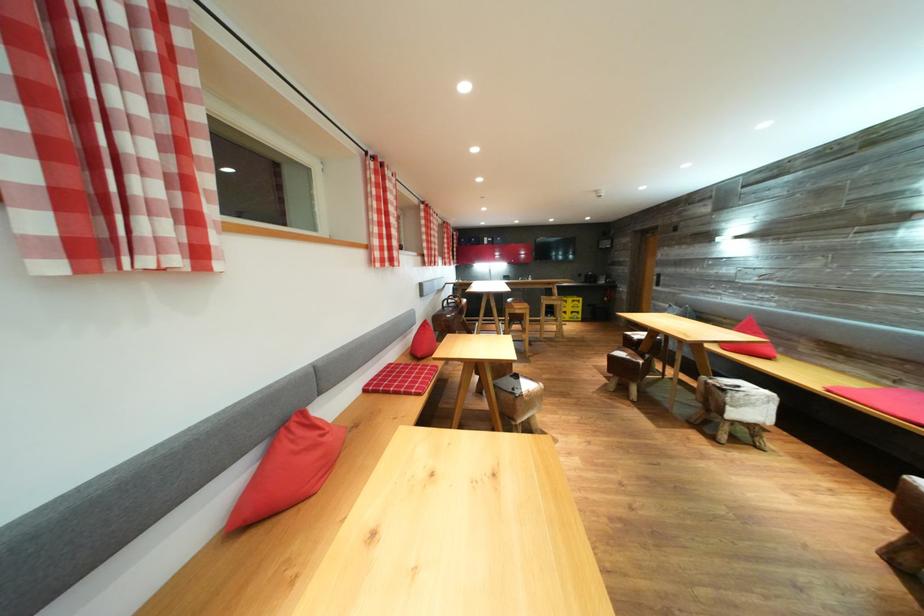
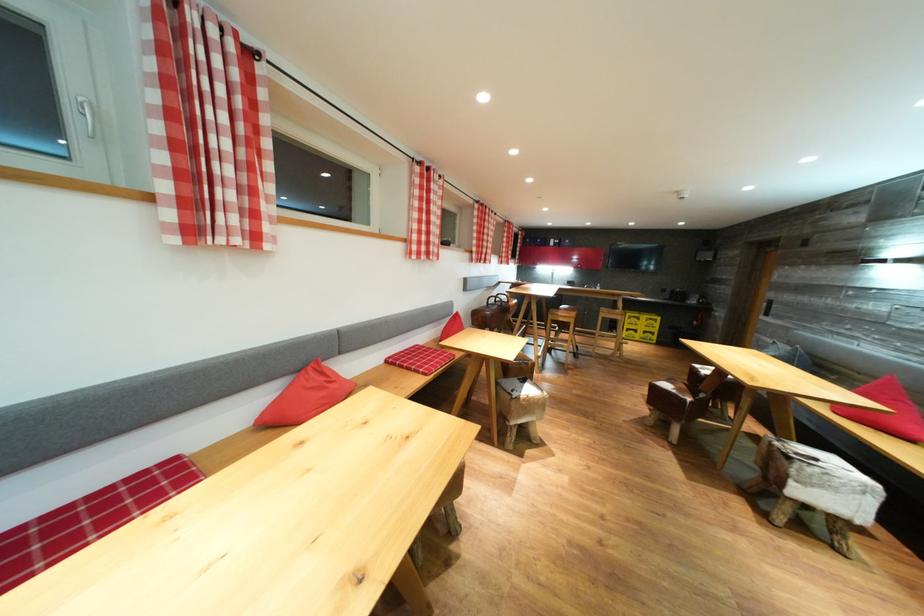
Find the pixel in the second image that matches (x=745, y=392) in the first image.

(821, 464)